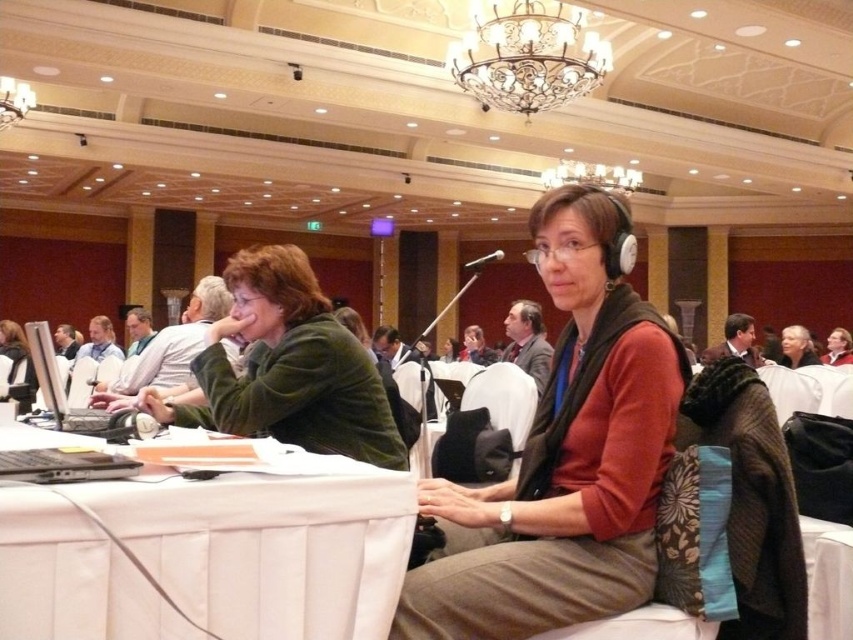
Question: Considering the real-world distances, which object is farthest from the green fuzzy sweater at center?

Choices:
 (A) metallic gold chandelier at upper center
 (B) white fabric table at lower left
 (C) matte red sweater at center
 (D) black matte laptop at left

Answer: (A)

Question: Where is white fabric table at lower left located in relation to green fuzzy sweater at center in the image?

Choices:
 (A) below
 (B) above

Answer: (A)

Question: Which point is closer to the camera?

Choices:
 (A) matte red sweater at center
 (B) black matte laptop at left
 (C) green fuzzy sweater at center

Answer: (A)

Question: Considering the real-world distances, which object is closest to the metallic gold chandelier at upper center?

Choices:
 (A) black matte laptop at left
 (B) green fuzzy sweater at center
 (C) white fabric table at lower left
 (D) matte red sweater at center

Answer: (B)

Question: Does white fabric table at lower left have a larger size compared to metallic gold chandelier at upper center?

Choices:
 (A) yes
 (B) no

Answer: (B)

Question: Is green fuzzy sweater at center smaller than black matte laptop at left?

Choices:
 (A) yes
 (B) no

Answer: (B)